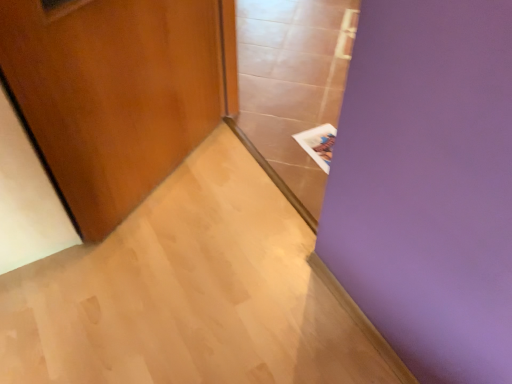
Find the location of `free point behind white paper at upper right`. free point behind white paper at upper right is located at coordinates (310, 112).